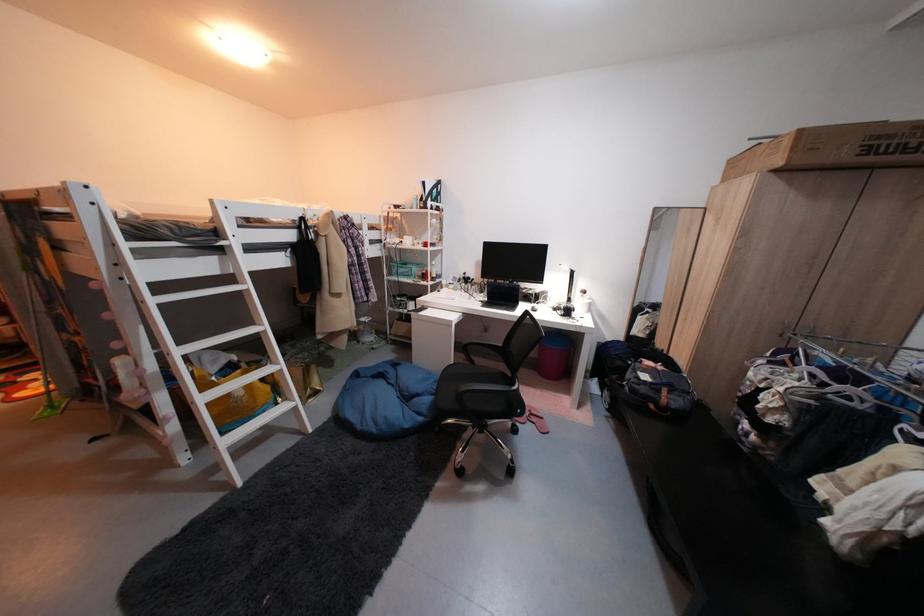
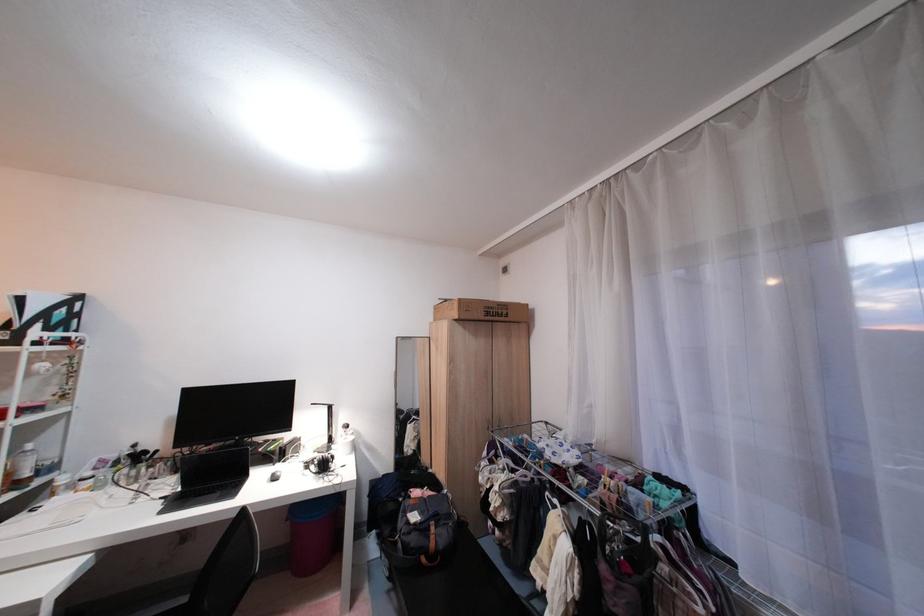
Locate, in the second image, the point that corresponds to pixel 663 408 in the first image.

(434, 561)